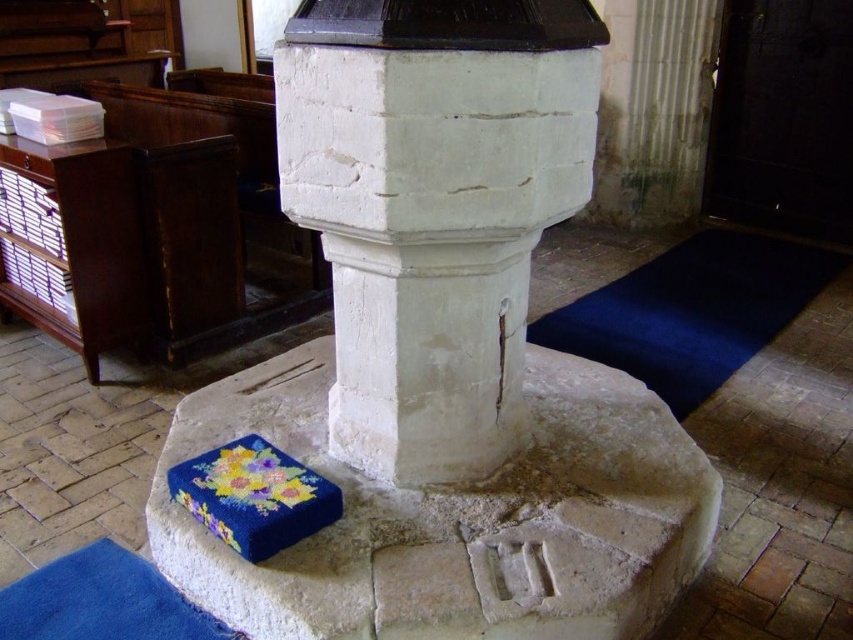
Who is positioned more to the right, blue felt box at lower left or dark blue carpet at lower right?

From the viewer's perspective, dark blue carpet at lower right appears more on the right side.

Does blue felt box at lower left appear under dark blue carpet at lower right?

Correct, blue felt box at lower left is located below dark blue carpet at lower right.

Is point (374, 488) more distant than point (527, 332)?

That is False.

You are a GUI agent. You are given a task and a screenshot of the screen. Output one action in this format:
    pyautogui.click(x=<x>, y=<y>)
    Task: Click on the blue felt box at lower left
    The height and width of the screenshot is (640, 853).
    Given the screenshot: What is the action you would take?
    pyautogui.click(x=456, y=515)

Which is in front, point (527, 477) or point (44, 602)?

Point (44, 602) is in front.

Does blue felt box at lower left appear over blue felt mat at lower left?

Yes, blue felt box at lower left is above blue felt mat at lower left.

Is point (473, 612) behind point (10, 609)?

No, (473, 612) is in front of (10, 609).

Locate an element on the screen. The image size is (853, 640). blue felt box at lower left is located at coordinates pyautogui.click(x=456, y=515).

Between dark blue carpet at lower right and blue felt mat at lower left, which one has less height?

Standing shorter between the two is blue felt mat at lower left.

Does dark blue carpet at lower right lie behind blue felt mat at lower left?

Yes, dark blue carpet at lower right is further from the viewer.

You are a GUI agent. You are given a task and a screenshot of the screen. Output one action in this format:
    pyautogui.click(x=<x>, y=<y>)
    Task: Click on the dark blue carpet at lower right
    The height and width of the screenshot is (640, 853).
    Given the screenshot: What is the action you would take?
    pyautogui.click(x=692, y=310)